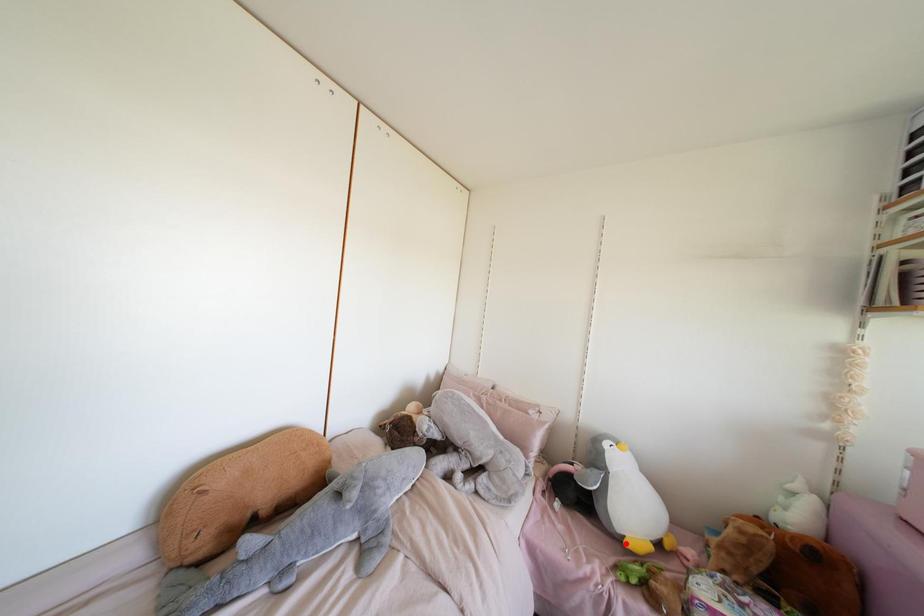
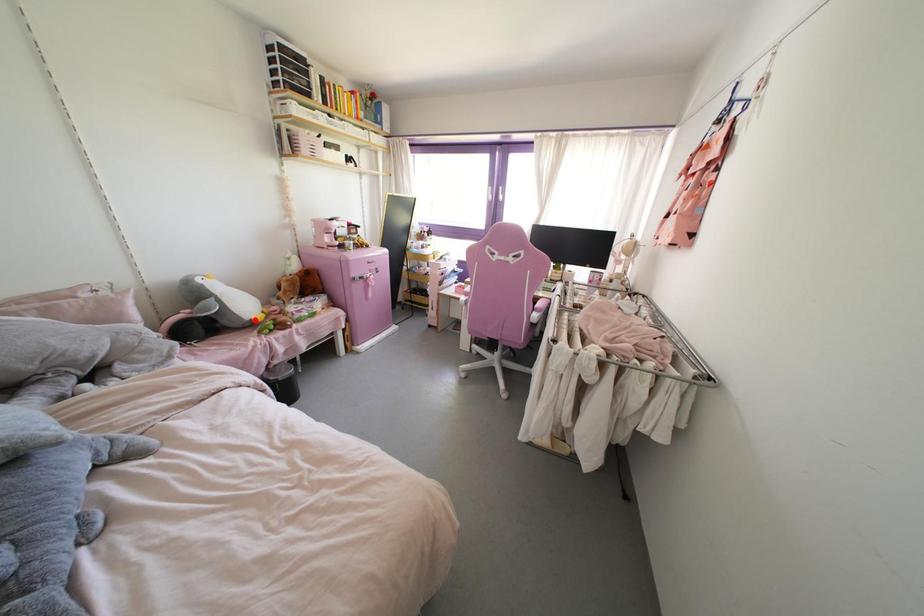
I am providing you with two images of the same scene from different viewpoints. A red point is marked on the first image and another point is marked on the second image. Is the red point in image1 aligned with the point shown in image2?

Yes